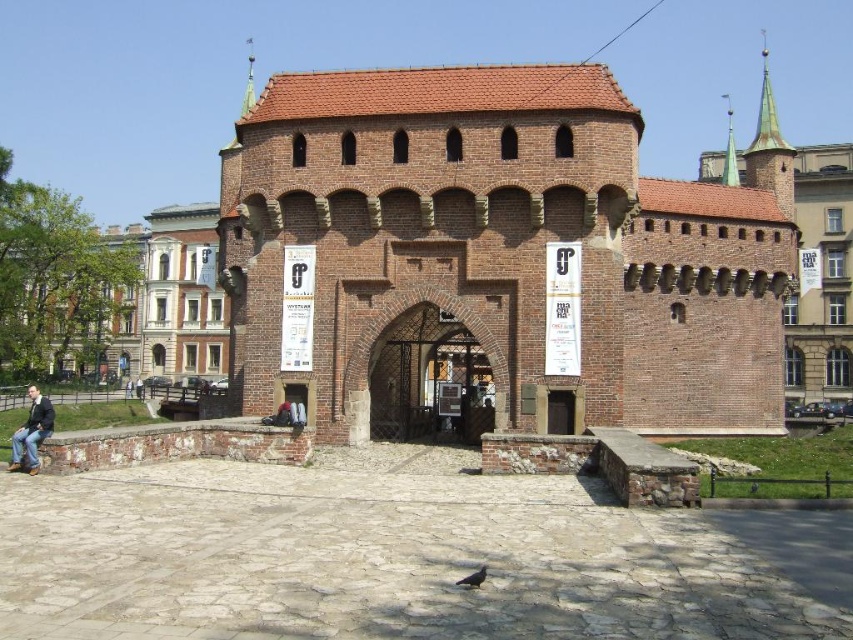
Question: Which point is farther to the camera?

Choices:
 (A) brick gate at center
 (B) purple feathered pigeon at center
 (C) gray matte pigeon at center
 (D) jeans at lower left

Answer: (A)

Question: Is jeans at lower left behind dark blue jeans at lower left?

Choices:
 (A) no
 (B) yes

Answer: (A)

Question: Which object is closer to the camera taking this photo?

Choices:
 (A) jeans at lower left
 (B) dark blue jeans at lower left
 (C) gray matte pigeon at center
 (D) purple feathered pigeon at center

Answer: (D)

Question: Which object is positioned closest to the jeans at lower left?

Choices:
 (A) gray matte pigeon at center
 (B) dark blue jeans at lower left
 (C) brick gate at center

Answer: (A)

Question: Is jeans at lower left above gray matte pigeon at center?

Choices:
 (A) yes
 (B) no

Answer: (A)

Question: Is the position of jeans at lower left more distant than that of gray matte pigeon at center?

Choices:
 (A) yes
 (B) no

Answer: (B)